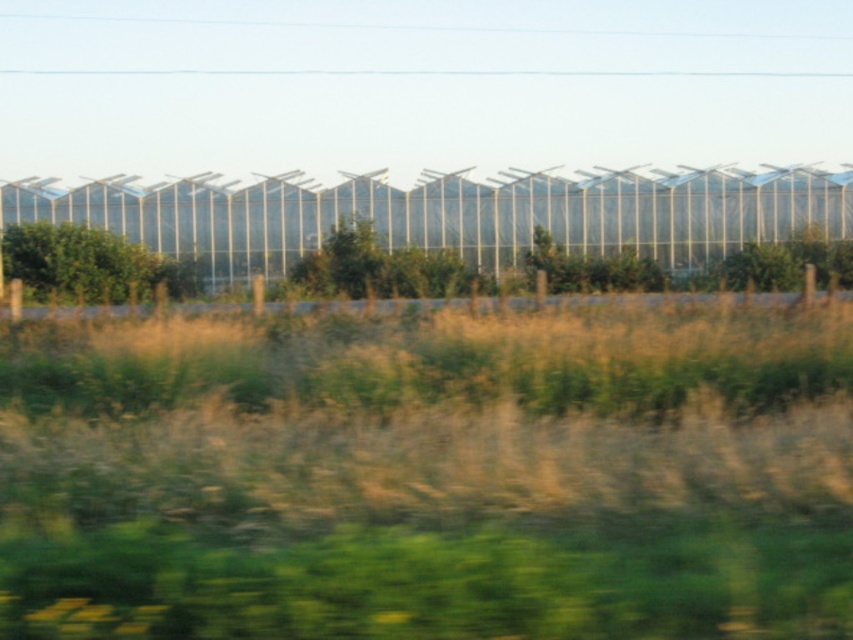
Is green grass at center thinner than green leafy tree at left?

No, green grass at center is not thinner than green leafy tree at left.

Can you confirm if green grass at center is positioned to the right of green leafy tree at left?

Correct, you'll find green grass at center to the right of green leafy tree at left.

I want to click on green grass at center, so click(x=428, y=474).